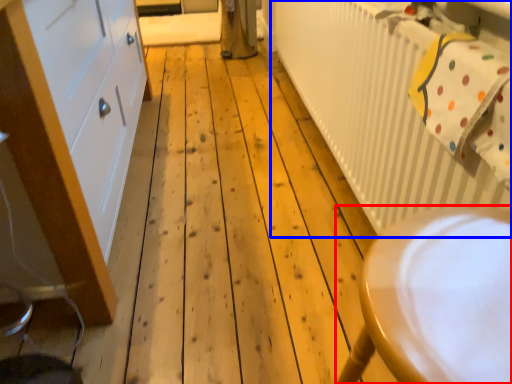
Question: Which point is closer to the camera, furniture (highlighted by a red box) or radiator (highlighted by a blue box)?

Choices:
 (A) furniture
 (B) radiator

Answer: (A)